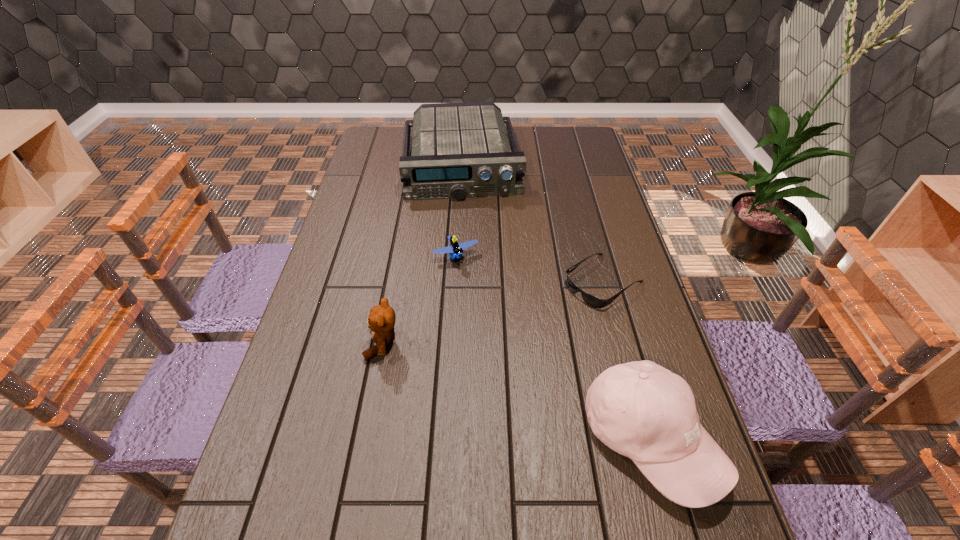
In order to click on object positioned at the left edge in this screenshot , I will do `click(459, 150)`.

At what (x,y) coordinates should I click in order to perform the action: click on baseball cap at the right edge. Please return your answer as a coordinate pair (x, y). Looking at the image, I should click on (639, 409).

Identify the location of sunglasses at the right edge. (591, 300).

At what (x,y) coordinates should I click in order to perform the action: click on object located in the far left corner section of the desktop. Please return your answer as a coordinate pair (x, y). Looking at the image, I should click on (459, 150).

The image size is (960, 540). In order to click on object that is at the near right corner in this screenshot , I will do `click(639, 409)`.

In the image, there is a desktop. Where is `free space at the near edge`? free space at the near edge is located at coordinates (494, 517).

You are a GUI agent. You are given a task and a screenshot of the screen. Output one action in this format:
    pyautogui.click(x=<x>, y=<y>)
    Task: Click on the free location at the left edge of the desktop
    The width and height of the screenshot is (960, 540).
    Given the screenshot: What is the action you would take?
    pyautogui.click(x=394, y=180)

Identify the location of blank space at the right edge of the desktop. This screenshot has height=540, width=960. (592, 170).

Locate an element on the screen. This screenshot has width=960, height=540. vacant space at the far left corner of the desktop is located at coordinates (386, 153).

Image resolution: width=960 pixels, height=540 pixels. I want to click on free spot at the far right corner of the desktop, so click(x=570, y=133).